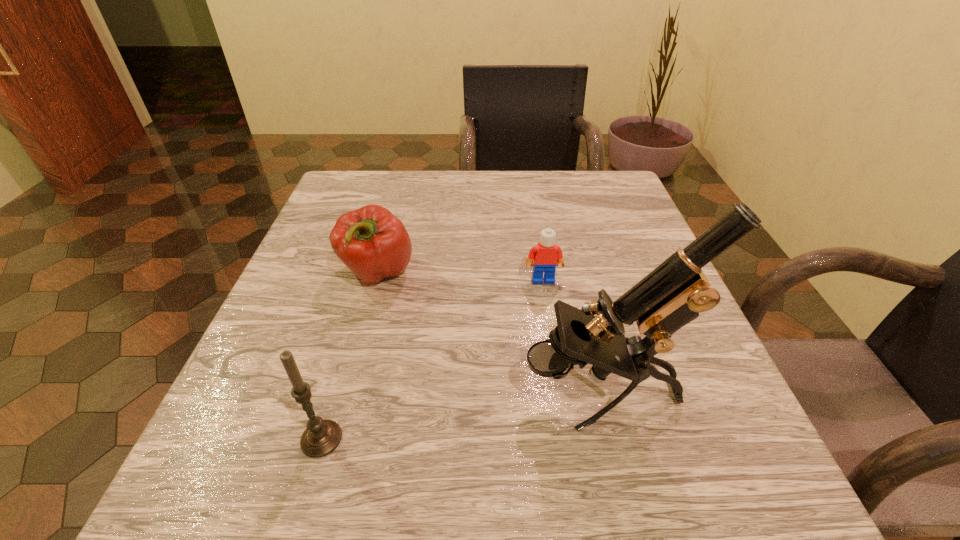
Where is `microscope`? This screenshot has height=540, width=960. microscope is located at coordinates (672, 295).

Where is `candle`? The image size is (960, 540). candle is located at coordinates (321, 437).

This screenshot has height=540, width=960. Find the location of `the third tallest object`. the third tallest object is located at coordinates (374, 244).

Where is `Lego`? The height and width of the screenshot is (540, 960). Lego is located at coordinates (546, 255).

The image size is (960, 540). Find the location of `vacant space located 0.120m through the eyepiece of the tallest object`. vacant space located 0.120m through the eyepiece of the tallest object is located at coordinates (441, 393).

Where is `free space located through the eyepiece of the tallest object`? free space located through the eyepiece of the tallest object is located at coordinates (338, 393).

Find the location of a particular element. The width and height of the screenshot is (960, 540). vacant space located 0.140m through the eyepiece of the tallest object is located at coordinates (427, 393).

Find the location of a particular element. The width and height of the screenshot is (960, 540). free space located on the front of the third shortest object is located at coordinates (301, 507).

In order to click on vacant space situated on the front of the third tallest object in this screenshot , I will do 336,427.

The width and height of the screenshot is (960, 540). I want to click on free spot located 0.340m on the face of the shortest object, so click(572, 461).